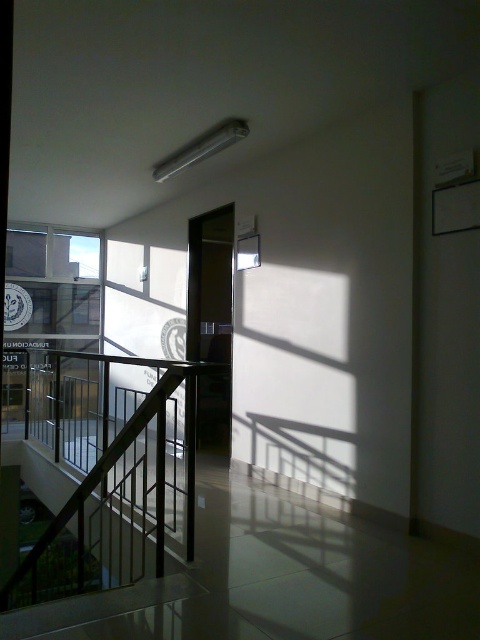
Question: Which point is closer to the camera?

Choices:
 (A) black metal railing at center
 (B) transparent glass window at upper left

Answer: (A)

Question: Is black metal railing at center above transparent glass window at upper left?

Choices:
 (A) yes
 (B) no

Answer: (B)

Question: Which object appears farthest from the camera in this image?

Choices:
 (A) black metal railing at center
 (B) transparent glass window at upper left

Answer: (B)

Question: Is black metal railing at center in front of transparent glass window at upper left?

Choices:
 (A) yes
 (B) no

Answer: (A)

Question: From the image, what is the correct spatial relationship of black metal railing at center in relation to transparent glass window at upper left?

Choices:
 (A) left
 (B) right

Answer: (B)